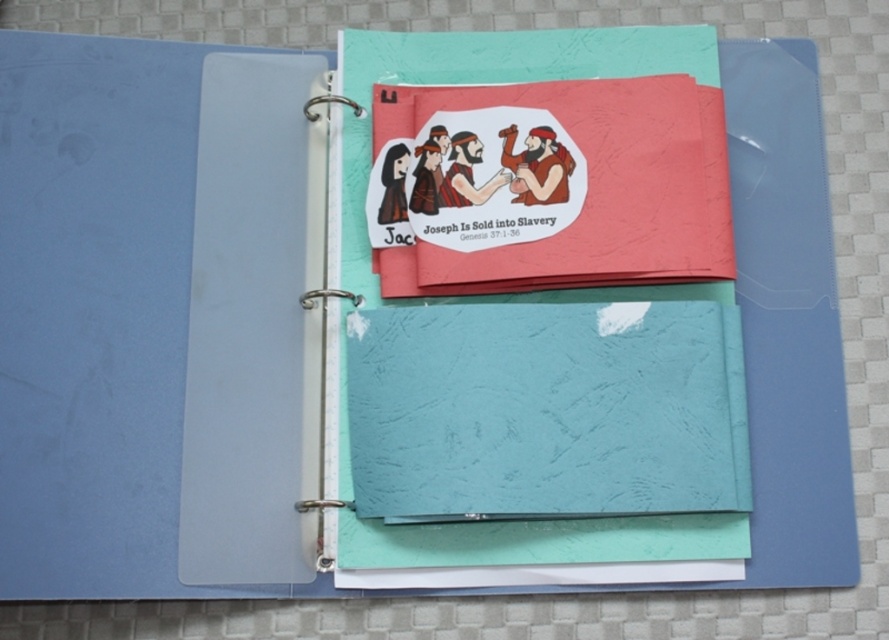
Question: Which of the following is the farthest from the observer?

Choices:
 (A) teal textured notepad at center
 (B) matte paper journal at center

Answer: (B)

Question: Does teal textured notepad at center appear over matte paper journal at center?

Choices:
 (A) no
 (B) yes

Answer: (A)

Question: Is teal textured notepad at center closer to camera compared to matte paper journal at center?

Choices:
 (A) yes
 (B) no

Answer: (A)

Question: Is teal textured notepad at center further to the viewer compared to matte paper journal at center?

Choices:
 (A) yes
 (B) no

Answer: (B)

Question: Which of the following is the farthest from the observer?

Choices:
 (A) matte paper journal at center
 (B) teal textured notepad at center

Answer: (A)